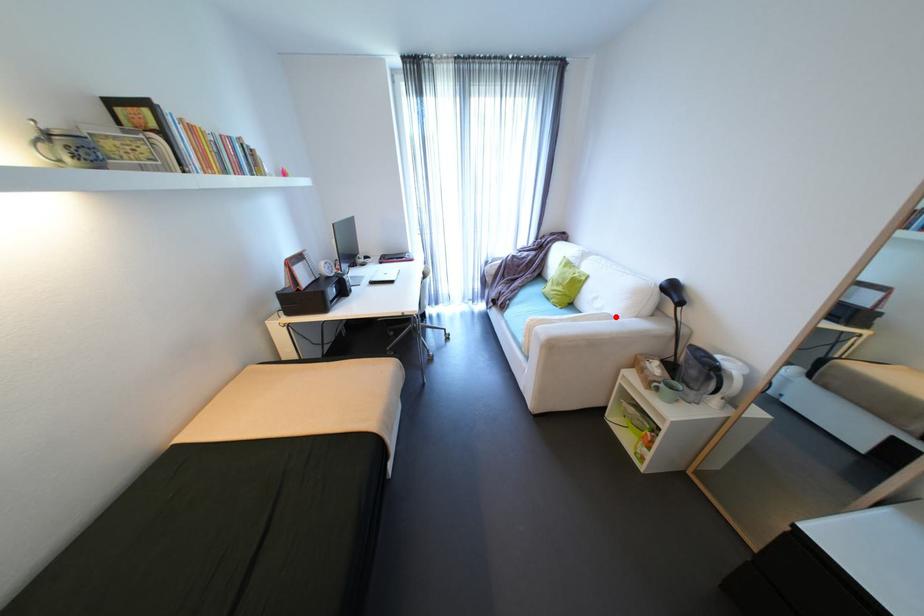
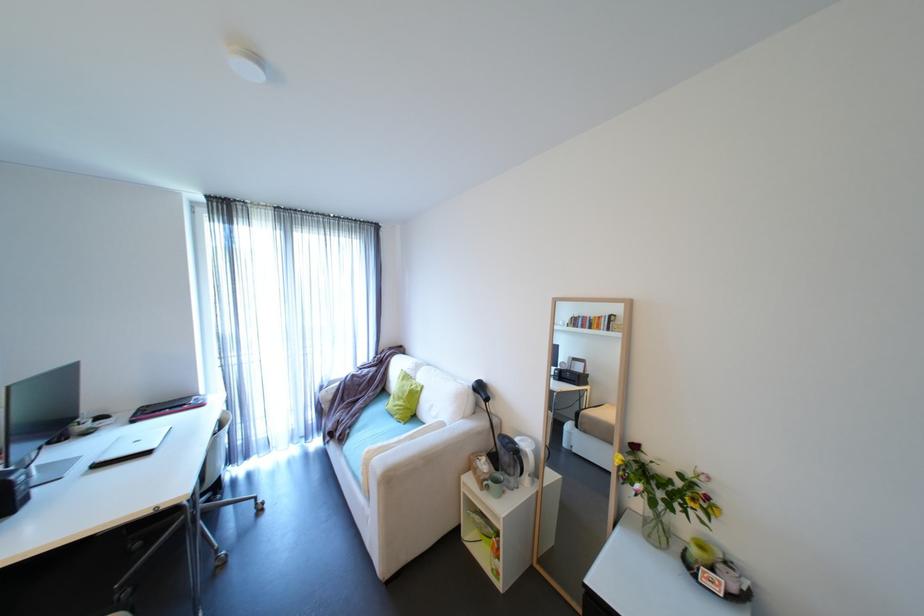
Where in the second image is the point corresponding to the highlighted location from the first image?

(450, 424)